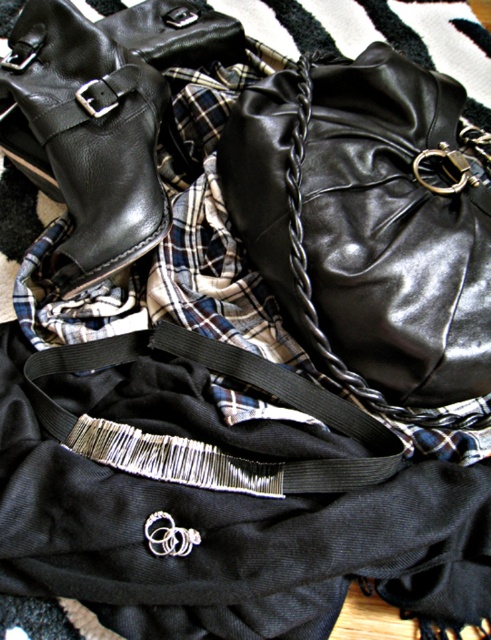
From the picture: You are a photographer trying to capture a closeup of the glossy leather bag at upper right without including the camera in the frame. The camera is positioned on the same surface. What should you do to ensure the camera isn

Move the camera further away from the glossy leather bag at upper right so that they are more than 37.33 inches apart. Since the current distance is 37.33 inches, moving it slightly back will ensure the camera is out of the frame while focusing on the glossy leather bag at upper right.

From the picture: You are organizing a small display and need to stack the glossy leather bag at upper right and the shiny black leather boot at upper left vertically. Based on their heights, which one should be placed at the bottom to ensure stability?

The glossy leather bag at upper right is much taller than the shiny black leather boot at upper left, so placing the taller glossy leather bag at upper right at the bottom would provide better stability due to its greater height.

You are organizing a photo shoot and need to adjust the items on the rug. You want to place a small accessory between the shiny black leather boot at upper left and the black fabric strap at center. Considering their positions, where should you position the accessory?

The black fabric strap at center is behind the shiny black leather boot at upper left, so you should place the accessory in front of the shiny black leather boot at upper left to ensure it is visible between them.